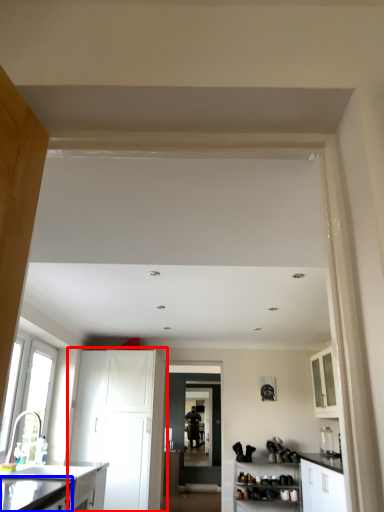
Question: Which object appears farthest to the camera in this image, cabinetry (highlighted by a red box) or counter top (highlighted by a blue box)?

Choices:
 (A) cabinetry
 (B) counter top

Answer: (A)